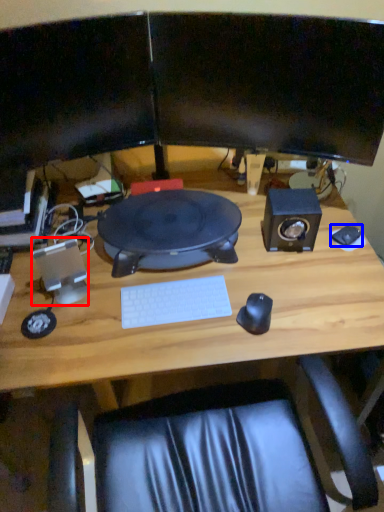
Question: Among these objects, which one is nearest to the camera, speaker (highlighted by a red box) or mouse (highlighted by a blue box)?

Choices:
 (A) speaker
 (B) mouse

Answer: (A)